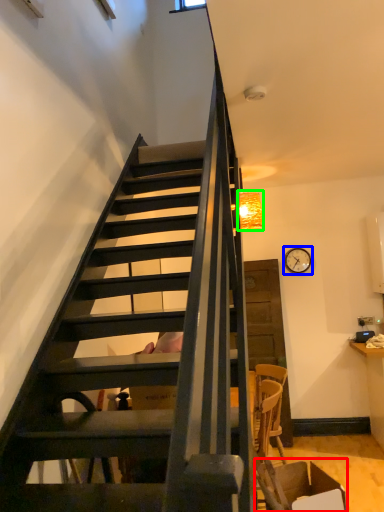
Question: Which object is positioned farthest from armchair (highlighted by a red box)? Select from clock (highlighted by a blue box) and lamp (highlighted by a green box).

Choices:
 (A) clock
 (B) lamp

Answer: (A)